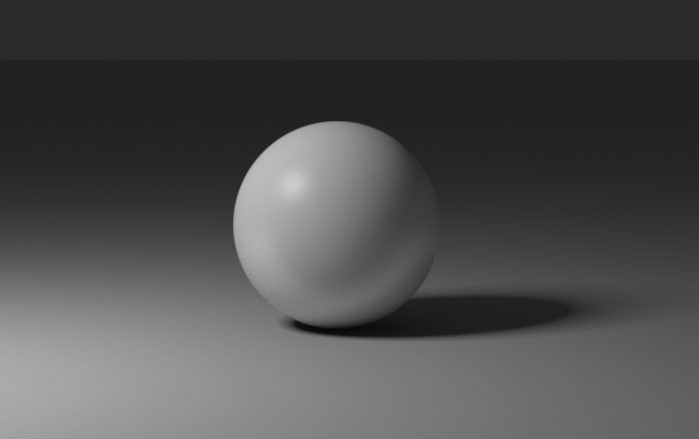
This screenshot has height=439, width=699. What are the coordinates of `corner` in the screenshot? It's located at 10,431, 690,432, 681,16, 24,39.